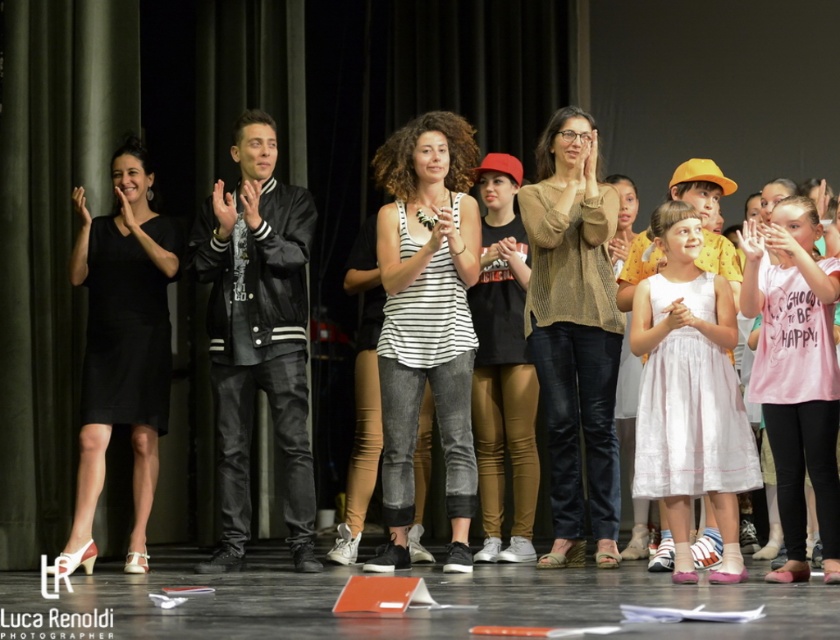
Question: Which object is the farthest from the white tulle dress at center?

Choices:
 (A) white striped tank top at center
 (B) pink cotton shirt at center
 (C) knitted beige sweater at center
 (D) black satin dress at center

Answer: (D)

Question: Does knitted beige sweater at center appear over black satin dress at center?

Choices:
 (A) yes
 (B) no

Answer: (A)

Question: Based on their relative distances, which object is nearer to the knitted beige sweater at center?

Choices:
 (A) pink cotton shirt at center
 (B) black satin dress at center

Answer: (A)

Question: Can you confirm if black satin dress at center is positioned above black matte t-shirt at center?

Choices:
 (A) no
 (B) yes

Answer: (B)

Question: In this image, where is white striped tank top at center located relative to knitted beige sweater at center?

Choices:
 (A) below
 (B) above

Answer: (A)

Question: Which point appears farthest from the camera in this image?

Choices:
 (A) (447, 189)
 (B) (518, 346)

Answer: (B)